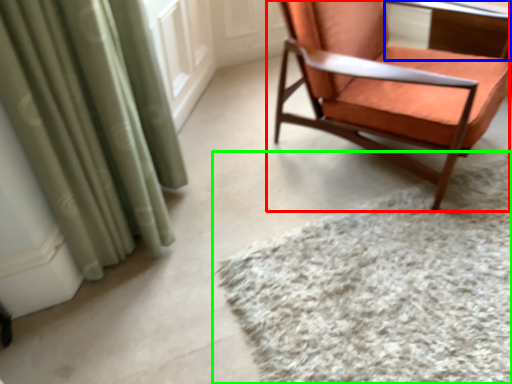
Question: Considering the real-world distances, which object is farthest from chair (highlighted by a red box)? table (highlighted by a blue box) or mat (highlighted by a green box)?

Choices:
 (A) table
 (B) mat

Answer: (A)